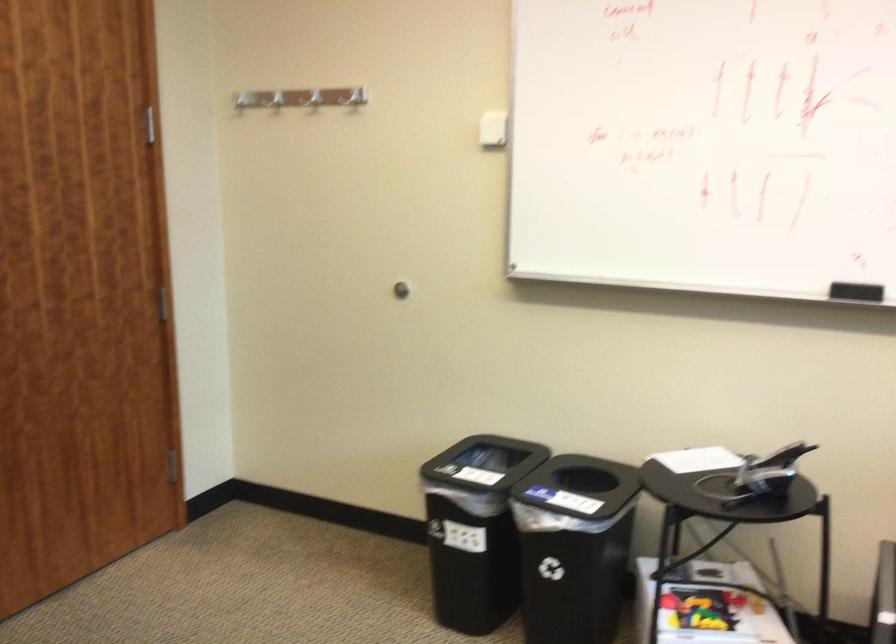
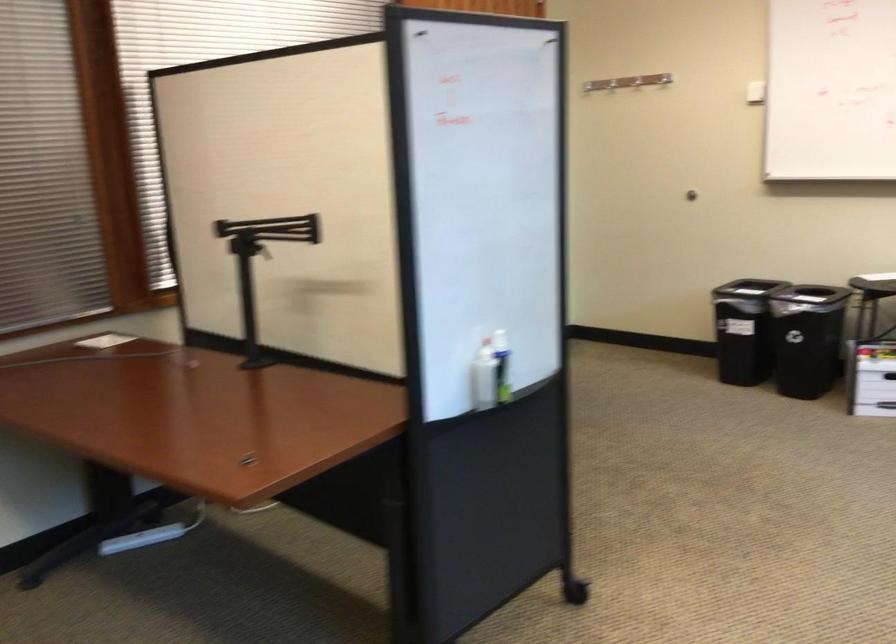
Find the pixel in the second image that matches the point at 391,113 in the first image.

(610, 84)